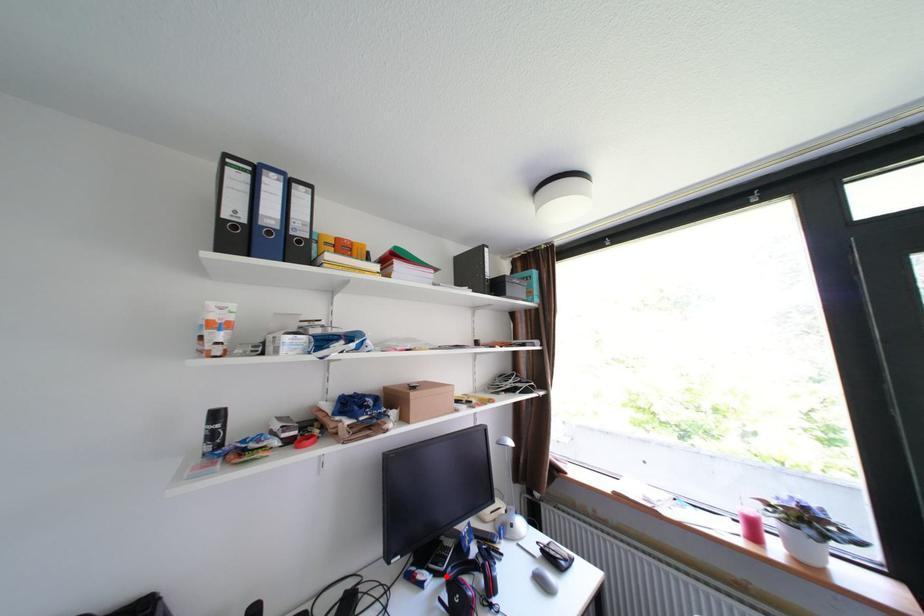
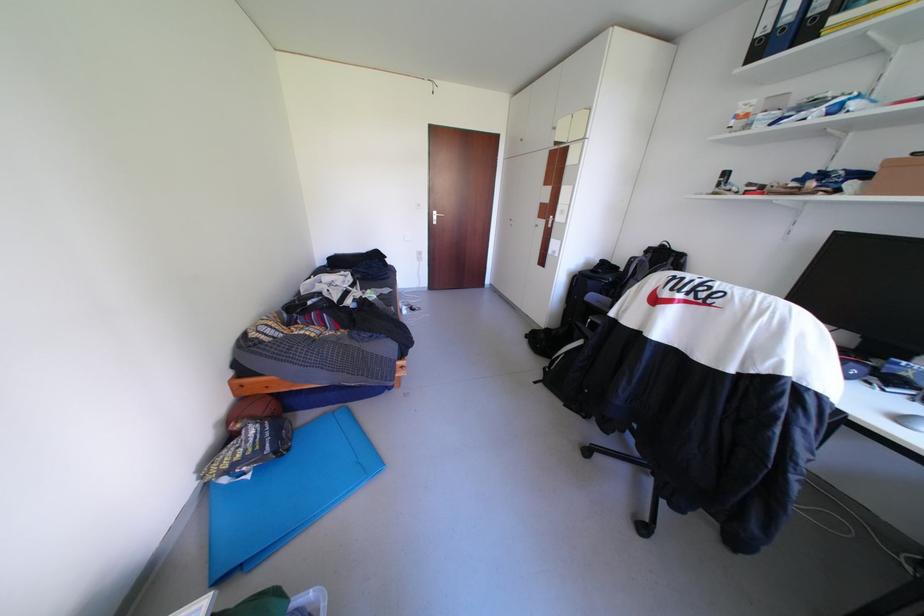
Question: I am providing you with two images of the same scene from different viewpoints. A red point is marked on the first image. Can you still see the location of the red point in image 2?

Choices:
 (A) Yes
 (B) No

Answer: (B)